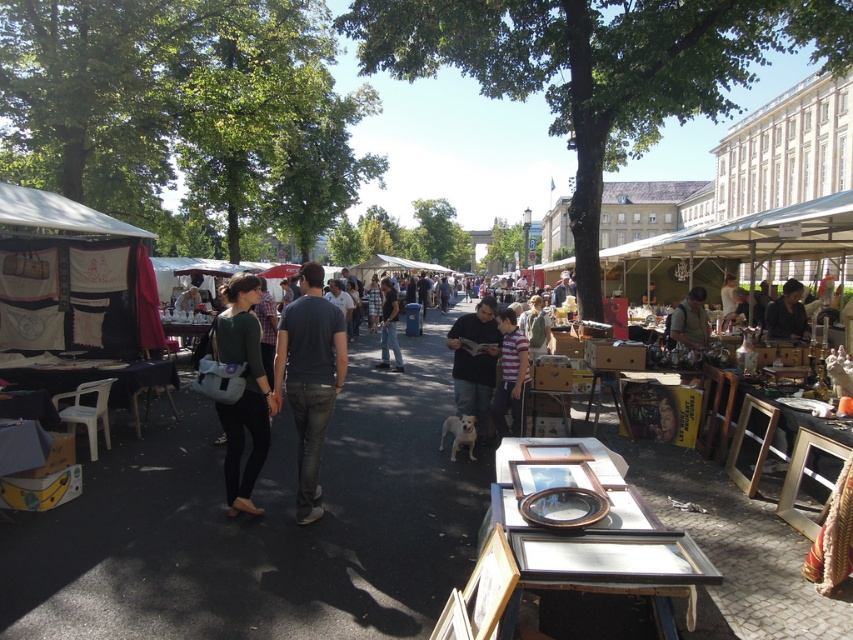
You are a customer at the flea market and want to pick up both the green fabric backpack at center and the dark brown leather jacket at center. Which item should you pick up first to avoid disturbing the other item?

You should pick up the green fabric backpack at center first because it is positioned under the dark brown leather jacket at center. Picking up the backpack first will prevent the jacket from being displaced when you move the backpack.

You are a photographer standing at the camera position. You want to capture a closeup shot of the matte brown leather jacket at center without moving the camera. Is it possible to do so with a standard 50mm lens?

The matte brown leather jacket at center is 8.25 meters from camera. With a standard 50mm lens, capturing a closeup shot from that distance would be challenging as the lens has a limited focal length for such proximity. A longer telephoto lens would be more appropriate for this distance.